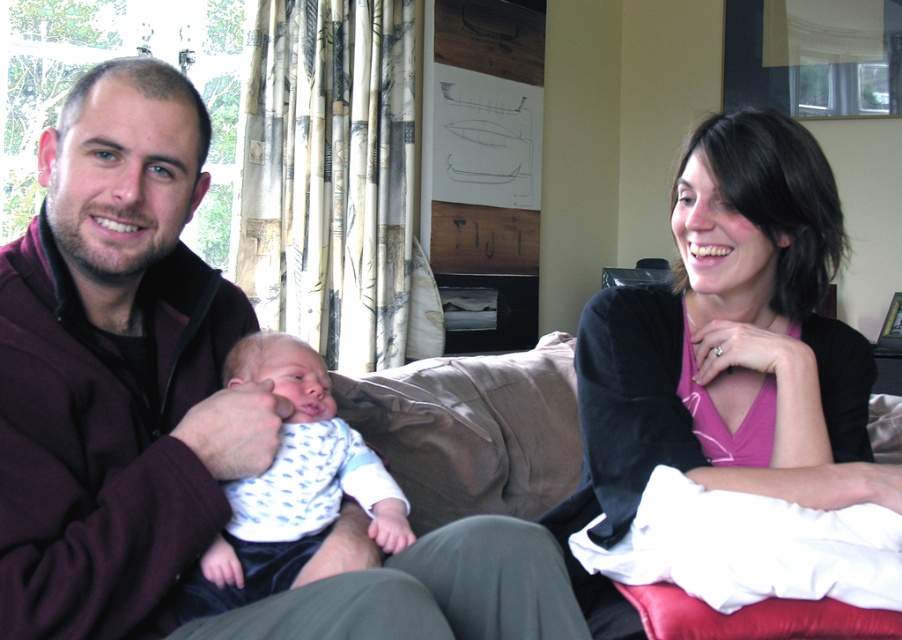
Which is more to the left, maroon fleece jacket at left or pink matte shirt at center?

maroon fleece jacket at left

Is maroon fleece jacket at left bigger than pink matte shirt at center?

Yes, maroon fleece jacket at left is bigger than pink matte shirt at center.

Is point (48, 189) closer to camera compared to point (787, 417)?

Yes.

Identify the location of maroon fleece jacket at left. (179, 413).

Is maroon fleece jacket at left shorter than white dotted fabric at center?

No, maroon fleece jacket at left is not shorter than white dotted fabric at center.

Is point (208, 355) positioned before point (223, 552)?

No, it is not.

You are a GUI agent. You are given a task and a screenshot of the screen. Output one action in this format:
    pyautogui.click(x=<x>, y=<y>)
    Task: Click on the maroon fleece jacket at left
    Image resolution: width=902 pixels, height=640 pixels.
    Given the screenshot: What is the action you would take?
    pyautogui.click(x=179, y=413)

How distant is pink matte shirt at center from white dotted fabric at center?

pink matte shirt at center is 18.10 inches away from white dotted fabric at center.

Which is in front, point (850, 444) or point (209, 563)?

Point (209, 563) is more forward.

Describe the element at coordinates (725, 352) in the screenshot. I see `pink matte shirt at center` at that location.

The width and height of the screenshot is (902, 640). I want to click on pink matte shirt at center, so click(x=725, y=352).